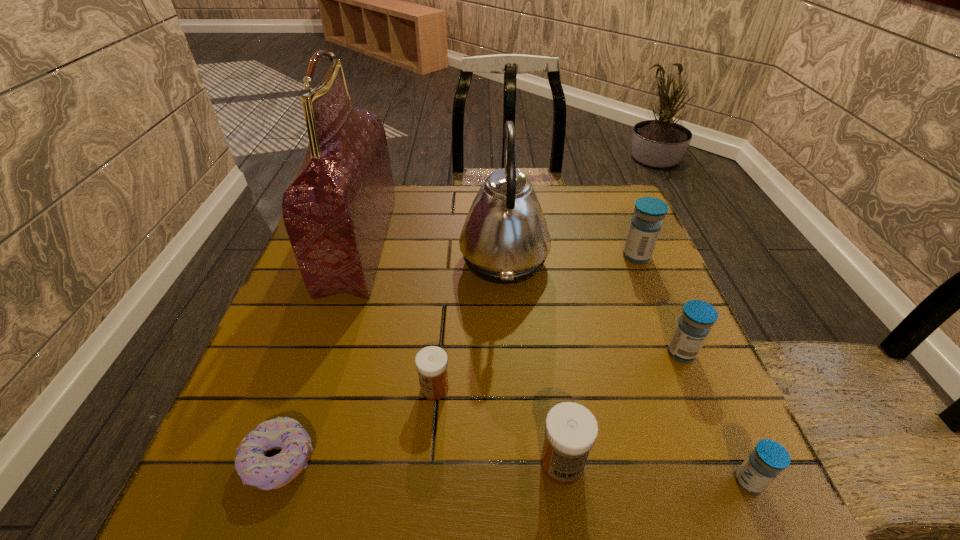
Identify the location of free space that is in between the biggest blue medicine and the leftmost medicine. Image resolution: width=960 pixels, height=540 pixels. (536, 322).

This screenshot has height=540, width=960. Identify the location of unoccupied position between the tallest object and the sixth object from right to left. click(396, 316).

This screenshot has height=540, width=960. Find the location of `free space between the kettle and the second nearest blue medicine`. free space between the kettle and the second nearest blue medicine is located at coordinates (592, 306).

Locate an element on the screen. The width and height of the screenshot is (960, 540). vacant area between the fourth medicine from right to left and the smaller white medicine is located at coordinates (498, 426).

The image size is (960, 540). What are the coordinates of `vacant space that's between the fourth nearest medicine and the tallest object` in the screenshot? It's located at (520, 299).

In order to click on free space that is in between the right white medicine and the smallest blue medicine in this screenshot , I will do `click(656, 472)`.

Where is `vacant area that lies between the tallest object and the fifth farthest object`? vacant area that lies between the tallest object and the fifth farthest object is located at coordinates (396, 316).

This screenshot has width=960, height=540. What are the coordinates of `the third closest object to the brown doughnut` in the screenshot? It's located at (571, 430).

Where is `object that ranks as the fifth closest to the second farthest blue medicine`? object that ranks as the fifth closest to the second farthest blue medicine is located at coordinates (431, 362).

Identify which medicine is the closest to the nearest blue medicine. Please provide its 2D coordinates. Your answer should be formatted as a tuple, i.e. [(x, y)], where the tuple contains the x and y coordinates of a point satisfying the conditions above.

[(694, 325)]